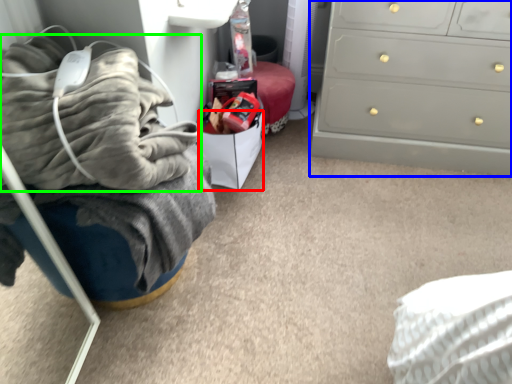
Question: Which is farther away from drawer (highlighted by a red box)? chest of drawers (highlighted by a blue box) or blanket (highlighted by a green box)?

Choices:
 (A) chest of drawers
 (B) blanket

Answer: (B)